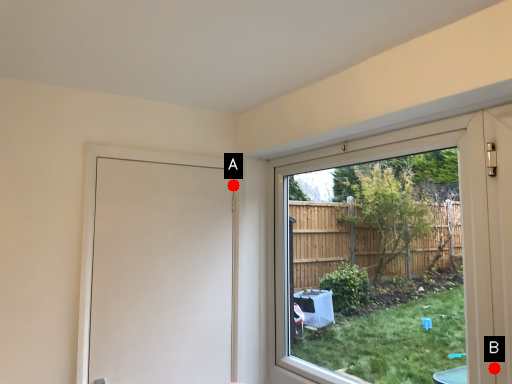
Question: Two points are circled on the image, labeled by A and B beside each circle. Which of the following is the closest to the observer?

Choices:
 (A) A is closer
 (B) B is closer

Answer: (B)